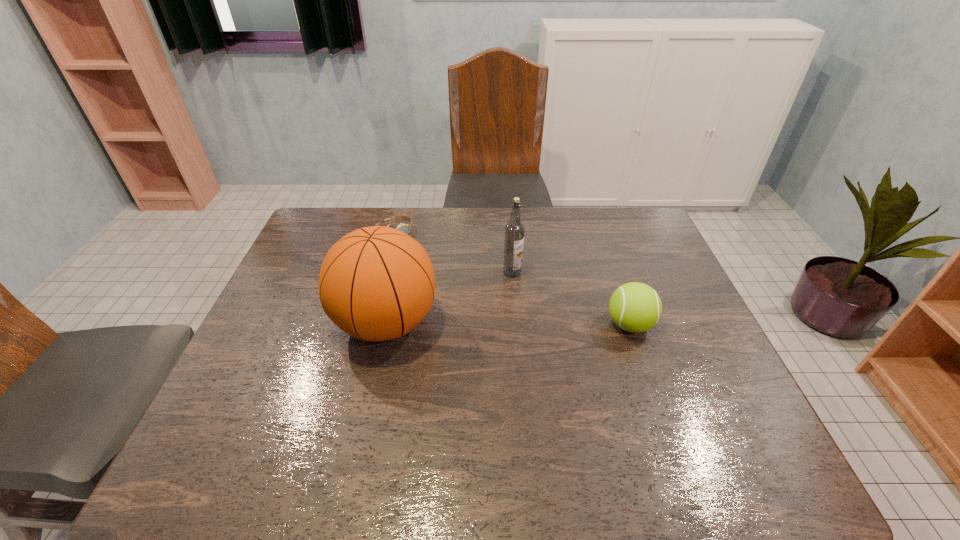
This screenshot has height=540, width=960. Find the location of `basketball`. basketball is located at coordinates (377, 283).

I want to click on the rightmost object, so click(x=635, y=307).

The image size is (960, 540). Identify the location of tennis ball. (635, 307).

You are a GUI agent. You are given a task and a screenshot of the screen. Output one action in this format:
    pyautogui.click(x=<x>, y=<y>)
    Task: Click on the farthest object
    
    Given the screenshot: What is the action you would take?
    pyautogui.click(x=406, y=228)

I want to click on watch, so click(406, 228).

I want to click on the third object from left to right, so click(x=514, y=230).

The image size is (960, 540). Identify the location of the second farthest object. (514, 230).

Where is `free space located on the right of the basketball`? free space located on the right of the basketball is located at coordinates (492, 323).

Where is `vacant area situated 0.060m on the back of the second shortest object`? vacant area situated 0.060m on the back of the second shortest object is located at coordinates (618, 292).

Locate an element on the screen. The width and height of the screenshot is (960, 540). vacant space located 0.290m on the face of the watch is located at coordinates (456, 288).